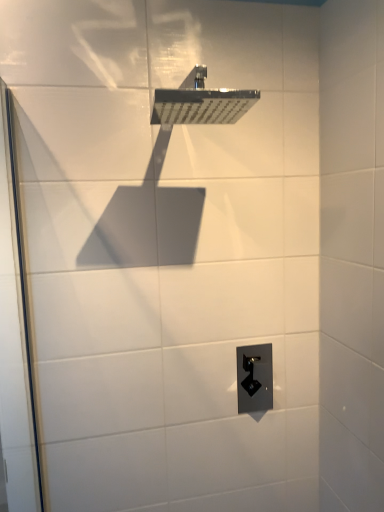
Question: Does point (249, 376) appear closer or farther from the camera than point (213, 96)?

Choices:
 (A) closer
 (B) farther

Answer: (B)

Question: Considering the relative positions of black plastic outlet at lower center and polished chrome shower head at upper center in the image provided, is black plastic outlet at lower center to the left or to the right of polished chrome shower head at upper center?

Choices:
 (A) right
 (B) left

Answer: (A)

Question: Estimate the real-world distances between objects in this image. Which object is closer to the transparent glass screen door at left?

Choices:
 (A) polished chrome shower head at upper center
 (B) black plastic outlet at lower center

Answer: (A)

Question: Which is farther from the polished chrome shower head at upper center?

Choices:
 (A) black plastic outlet at lower center
 (B) transparent glass screen door at left

Answer: (A)